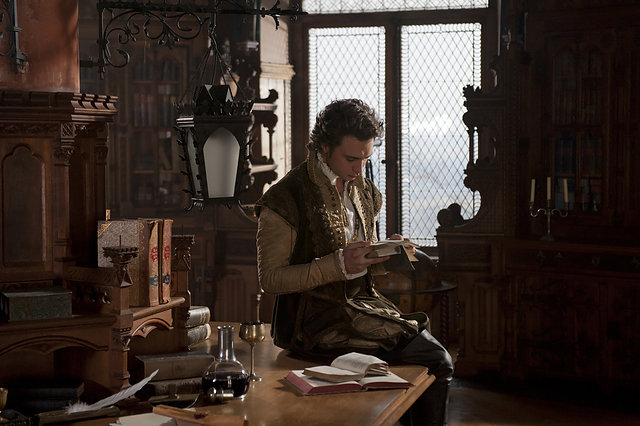
The image size is (640, 426). What are the coordinates of `desk surface` in the screenshot? It's located at (299, 408).